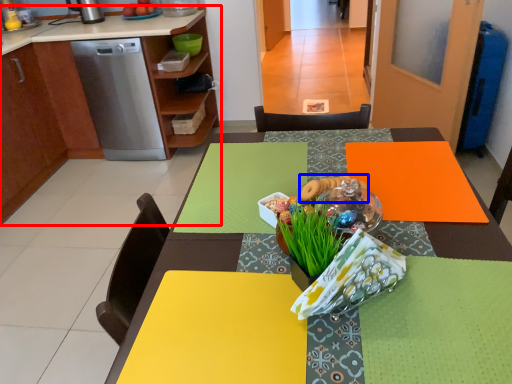
Question: Among these objects, which one is nearest to the camera, cabinetry (highlighted by a red box) or food (highlighted by a blue box)?

Choices:
 (A) cabinetry
 (B) food

Answer: (B)